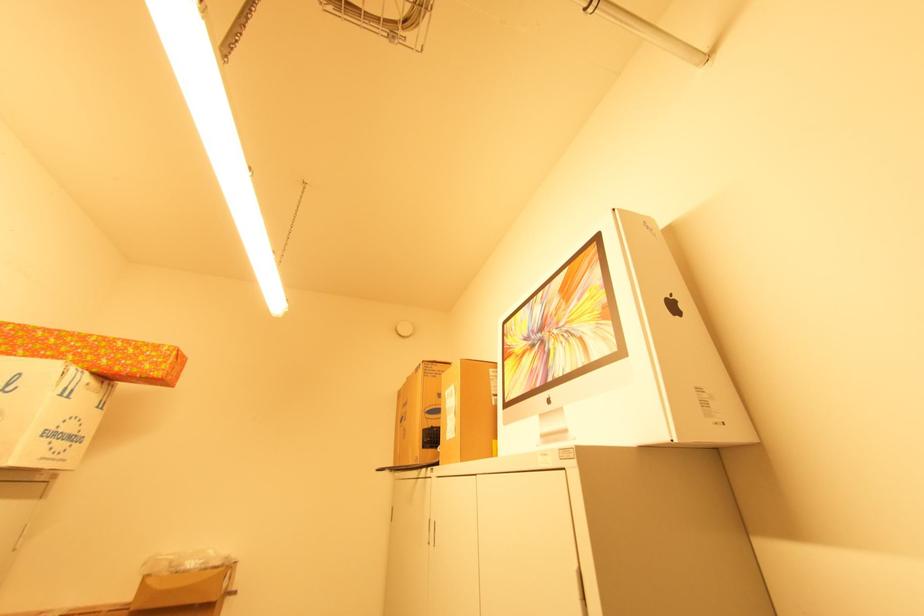
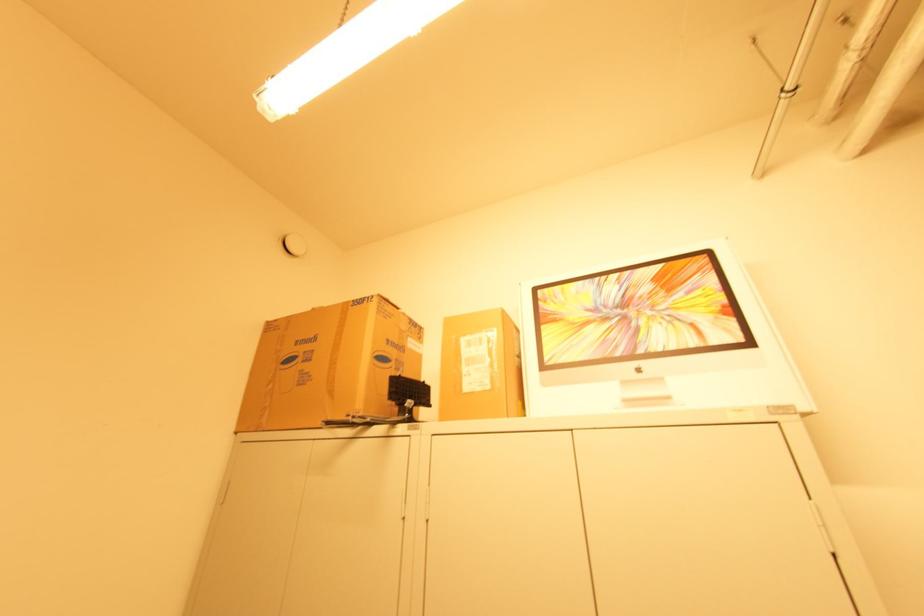
Locate, in the second image, the point that corresponds to point 543,333 in the first image.

(625, 310)